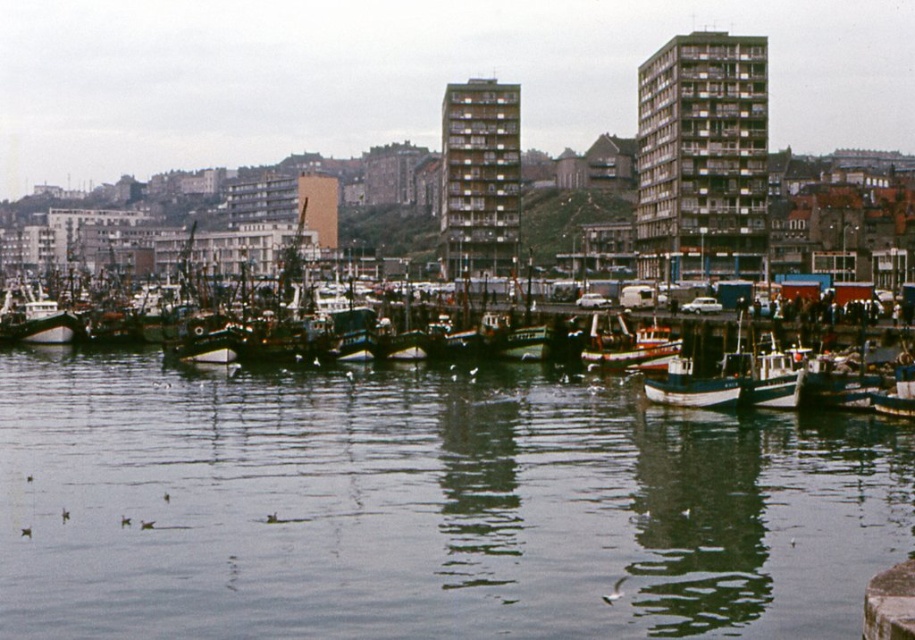
Can you confirm if clear water at center is smaller than dark blue wooden boat at left?

Actually, clear water at center might be larger than dark blue wooden boat at left.

Is clear water at center bigger than dark blue wooden boat at left?

Yes.

Who is more distant from viewer, [459,516] or [30,337]?

The point [30,337] is behind.

The height and width of the screenshot is (640, 915). I want to click on clear water at center, so click(x=427, y=508).

Between point (675, 336) and point (23, 321), which one is positioned in front?

Point (675, 336)

Based on the photo, can you confirm if wooden fishing boat at center is taller than dark blue wooden boat at left?

In fact, wooden fishing boat at center may be shorter than dark blue wooden boat at left.

Which is behind, point (674, 349) or point (34, 301)?

Positioned behind is point (34, 301).

Locate an element on the screen. This screenshot has width=915, height=640. wooden fishing boat at center is located at coordinates (627, 342).

Is clear water at center shorter than wooden fishing boat at center?

Incorrect, clear water at center's height does not fall short of wooden fishing boat at center's.

Who is taller, clear water at center or wooden fishing boat at center?

clear water at center is taller.

Where is `clear water at center`? This screenshot has width=915, height=640. clear water at center is located at coordinates (427, 508).